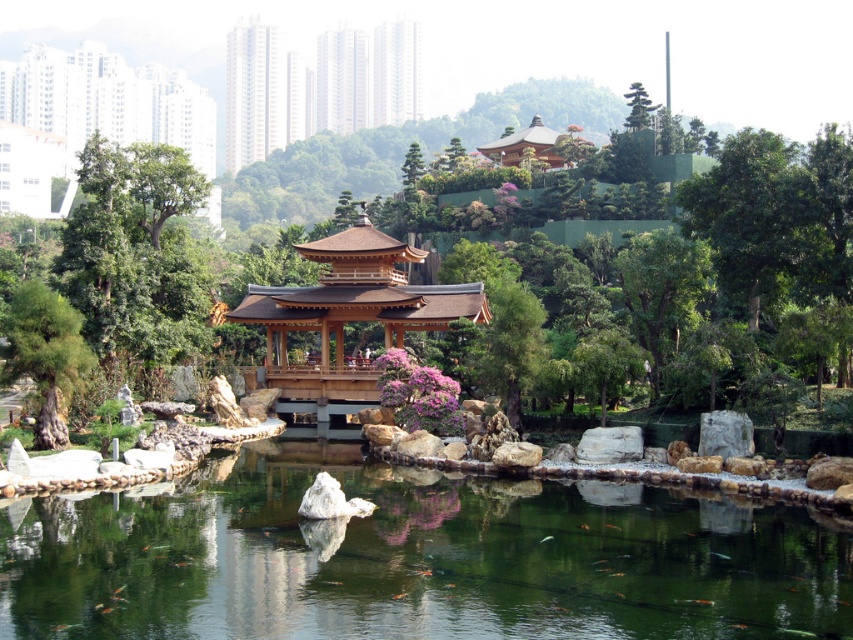
Does green leafy tree at upper right have a lesser height compared to wooden pagoda at upper center?

Indeed, green leafy tree at upper right has a lesser height compared to wooden pagoda at upper center.

Can you confirm if green leafy tree at upper right is bigger than wooden pagoda at upper center?

No.

I want to click on green leafy tree at upper right, so click(x=776, y=216).

Can you confirm if green leafy tree at upper right is shorter than natural wood gazebo at center?

Incorrect, green leafy tree at upper right's height does not fall short of natural wood gazebo at center's.

Between point (762, 273) and point (397, 330), which one is positioned behind?

Point (397, 330)

You are a GUI agent. You are given a task and a screenshot of the screen. Output one action in this format:
    pyautogui.click(x=<x>, y=<y>)
    Task: Click on the green leafy tree at upper right
    The image size is (853, 640).
    Given the screenshot: What is the action you would take?
    pyautogui.click(x=776, y=216)

Who is more forward, (364, 216) or (3, 376)?

Point (3, 376) is more forward.

Which is more to the right, natural wood gazebo at center or green textured tree at left?

From the viewer's perspective, natural wood gazebo at center appears more on the right side.

Does point (341, 259) come closer to viewer compared to point (55, 312)?

That is False.

Locate an element on the screen. The image size is (853, 640). natural wood gazebo at center is located at coordinates (349, 316).